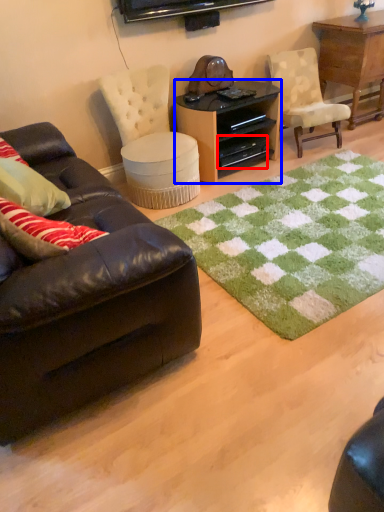
Question: Among these objects, which one is nearest to the camera, drawer (highlighted by a red box) or desk (highlighted by a blue box)?

Choices:
 (A) drawer
 (B) desk

Answer: (B)